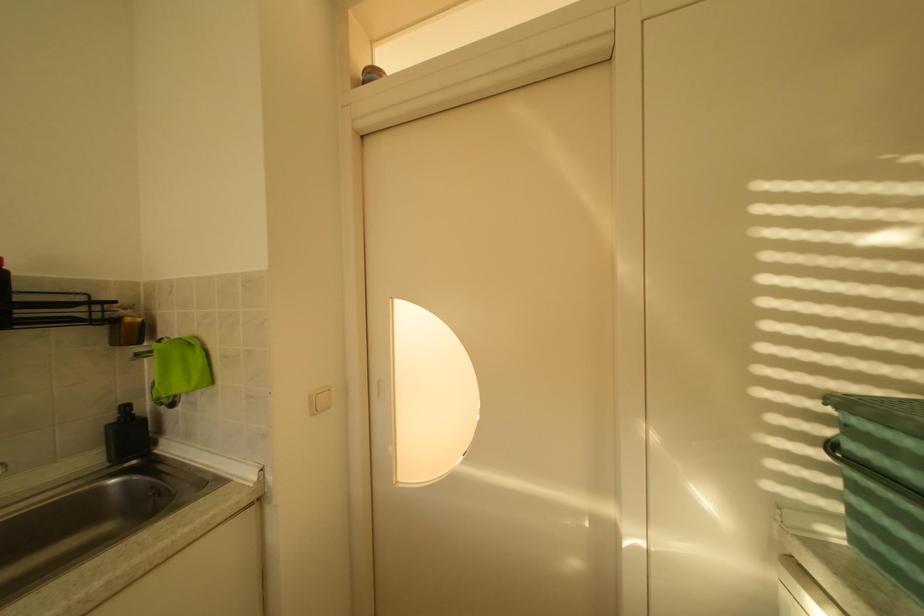
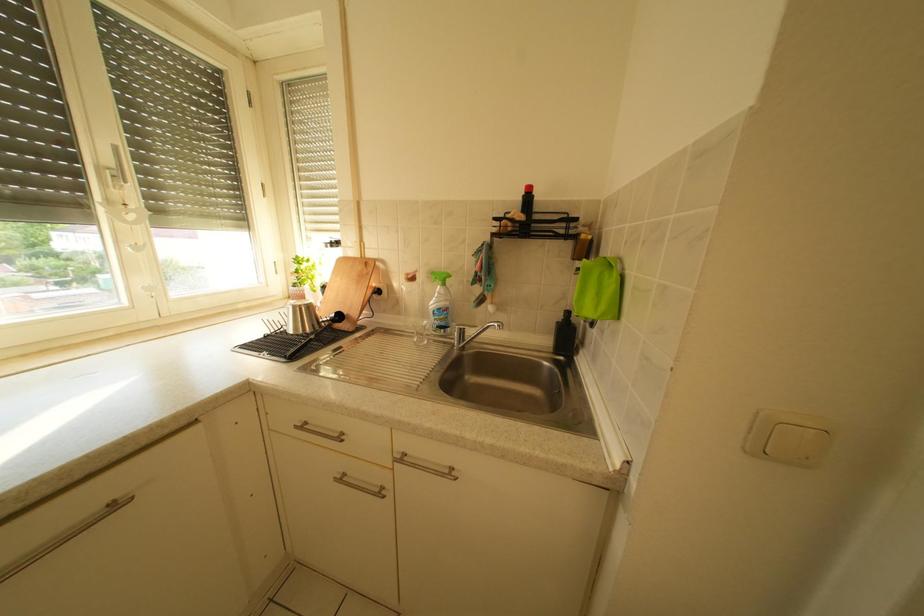
How did the camera likely rotate?

The camera's rotation is toward left-down.